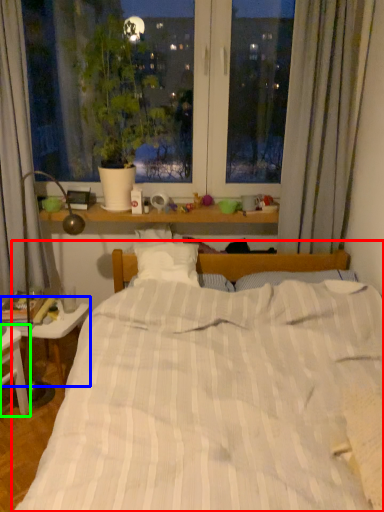
Question: Considering the real-world distances, which object is farthest from bed (highlighted by a red box)? table (highlighted by a blue box) or nightstand (highlighted by a green box)?

Choices:
 (A) table
 (B) nightstand

Answer: (A)